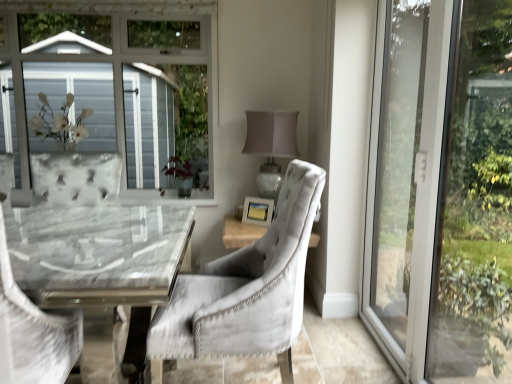
Question: Is matte gray lampshade at upper right positioned far away from velvet grey chair at center, arranged as the 1th chair when viewed from the right?

Choices:
 (A) yes
 (B) no

Answer: (A)

Question: Is matte gray lampshade at upper right smaller than velvet grey chair at center, arranged as the 1th chair when viewed from the right?

Choices:
 (A) no
 (B) yes

Answer: (B)

Question: Does matte gray lampshade at upper right turn towards velvet grey chair at center, arranged as the 1th chair when viewed from the right?

Choices:
 (A) no
 (B) yes

Answer: (B)

Question: Is matte gray lampshade at upper right outside of velvet grey chair at center, which appears as the second chair when viewed from the left?

Choices:
 (A) no
 (B) yes

Answer: (B)

Question: Does matte gray lampshade at upper right have a greater width compared to velvet grey chair at center, which appears as the second chair when viewed from the left?

Choices:
 (A) no
 (B) yes

Answer: (A)

Question: Which is correct: matte gray lampshade at upper right is inside transparent glass door at right, or outside of it?

Choices:
 (A) inside
 (B) outside

Answer: (B)

Question: Considering their positions, is matte gray lampshade at upper right located in front of or behind transparent glass door at right?

Choices:
 (A) front
 (B) behind

Answer: (B)

Question: Looking at the image, does matte gray lampshade at upper right seem bigger or smaller compared to transparent glass door at right?

Choices:
 (A) small
 (B) big

Answer: (A)

Question: Considering the relative positions of matte gray lampshade at upper right and transparent glass door at right in the image provided, is matte gray lampshade at upper right to the left or to the right of transparent glass door at right?

Choices:
 (A) left
 (B) right

Answer: (A)

Question: Does point (183, 168) appear closer or farther from the camera than point (404, 231)?

Choices:
 (A) closer
 (B) farther

Answer: (B)

Question: Considering the positions of green matte plant at center and transparent glass door at right in the image, is green matte plant at center taller or shorter than transparent glass door at right?

Choices:
 (A) short
 (B) tall

Answer: (A)

Question: Is green matte plant at center situated inside transparent glass door at right or outside?

Choices:
 (A) inside
 (B) outside

Answer: (B)

Question: Is green matte plant at center in front of or behind transparent glass door at right in the image?

Choices:
 (A) behind
 (B) front

Answer: (A)

Question: Based on their positions, is green matte plant at center located to the left or right of matte wooden picture frame at center?

Choices:
 (A) right
 (B) left

Answer: (B)

Question: Does point (179, 178) appear closer or farther from the camera than point (249, 208)?

Choices:
 (A) farther
 (B) closer

Answer: (A)